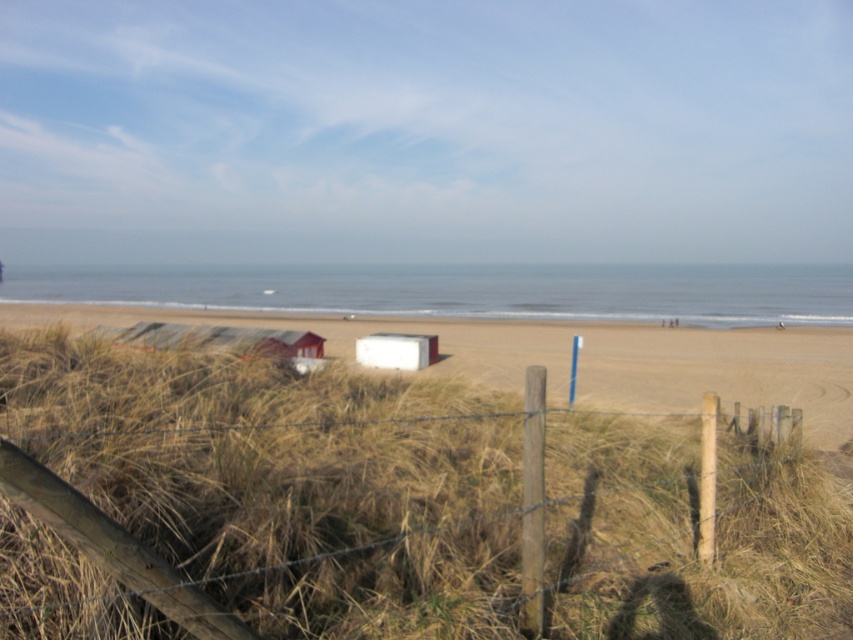
Question: Does beige sandy beach at center have a greater width compared to white matte beach hut at center?

Choices:
 (A) no
 (B) yes

Answer: (B)

Question: Does golden dry grass at center come behind beige sandy beach at center?

Choices:
 (A) no
 (B) yes

Answer: (A)

Question: Which of the following is the closest to the observer?

Choices:
 (A) golden dry grass at center
 (B) white matte beach hut at center
 (C) beige sandy beach at center

Answer: (A)

Question: Which of the following is the farthest from the observer?

Choices:
 (A) (798, 342)
 (B) (347, 636)
 (C) (386, 337)

Answer: (A)

Question: Is the position of golden dry grass at center more distant than that of white matte beach hut at center?

Choices:
 (A) no
 (B) yes

Answer: (A)

Question: Which object appears farthest from the camera in this image?

Choices:
 (A) beige sandy beach at center
 (B) golden dry grass at center
 (C) white matte beach hut at center

Answer: (C)